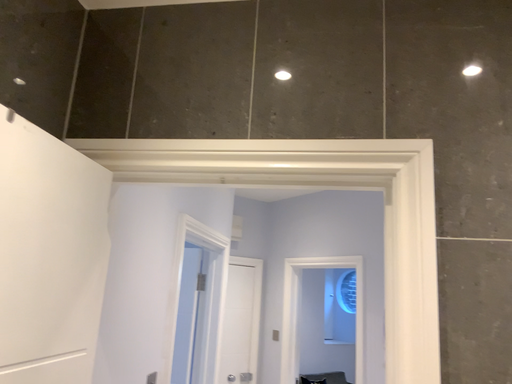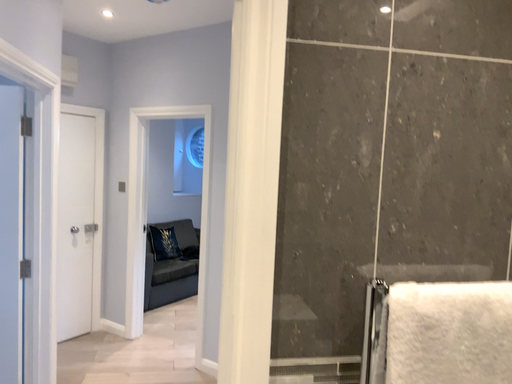
Question: Which way did the camera rotate in the video?

Choices:
 (A) rotated upward
 (B) rotated downward

Answer: (B)